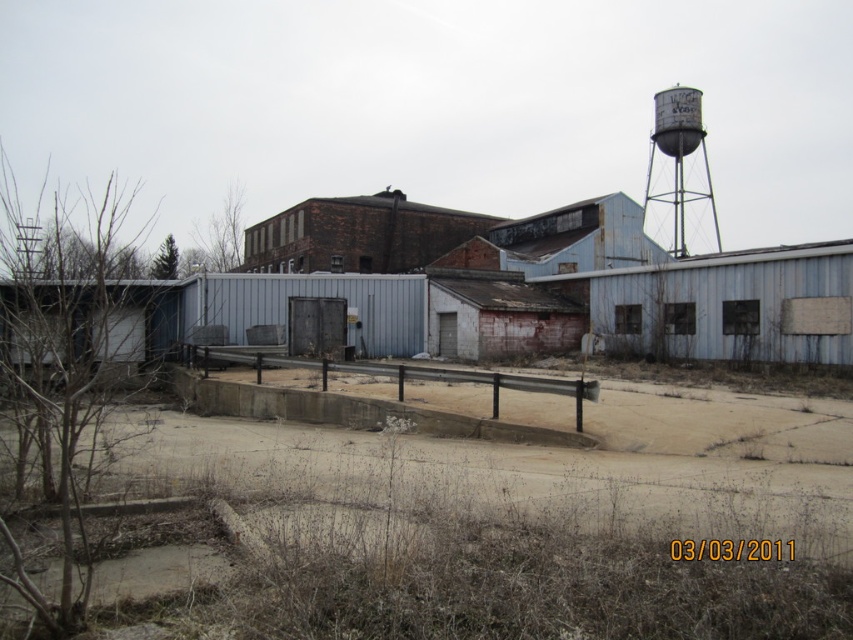
You are a construction worker planning to place a heavy equipment on the brown dirt field at center. However, there is a rusty metal water tower at upper right above it. Is there enough vertical clearance for the equipment to operate safely?

The brown dirt field at center is positioned under the rusty metal water tower at upper right, meaning the water tower is directly overhead. This would likely limit vertical clearance, so the equipment may not have enough space to operate safely without hitting the tower.

From the picture: You are a delivery driver who needs to park your truck in the brown dirt field at center. However, there is a rusty metal water tower at upper right nearby. From the driver seat, will the water tower be visible once parked?

The brown dirt field at center is in front of the rusty metal water tower at upper right, so when parked on the brown dirt field at center, the rusty metal water tower at upper right will be behind it and thus not visible from the driver seat.

From the picture: You are a surveyor tasked with assessing the condition of the industrial site. You notice the brown dirt field at center and the rusty metal water tower at upper right. Which of these two objects has a smaller width?

The brown dirt field at center is thinner than the rusty metal water tower at upper right, so the brown dirt field at center has the smaller width.